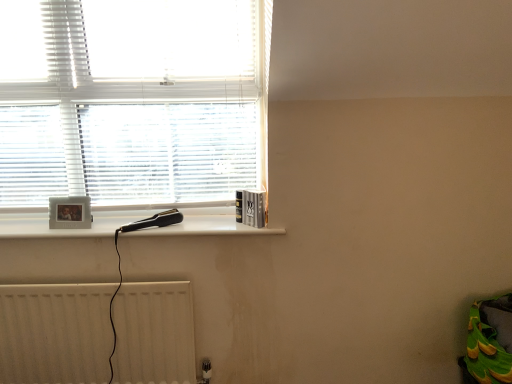
In order to face white textured blinds at upper left, should I rotate leftwards or rightwards?

To face it directly, rotate left by 17.562 degrees.

The image size is (512, 384). Find the location of `white textured radiator at lower left`. white textured radiator at lower left is located at coordinates (55, 333).

Is white textured blinds at upper left at the left side of white textured radiator at lower left?

Incorrect, white textured blinds at upper left is not on the left side of white textured radiator at lower left.

From a real-world perspective, which is physically below, white textured blinds at upper left or white textured radiator at lower left?

white textured radiator at lower left is physically lower.

Is point (230, 173) in front of point (92, 347)?

No.

Is white textured blinds at upper left wider than white textured radiator at lower left?

Indeed, white textured blinds at upper left has a greater width compared to white textured radiator at lower left.

Is white textured radiator at lower left bigger or smaller than white textured blinds at upper left?

Considering their sizes, white textured radiator at lower left takes up less space than white textured blinds at upper left.

Which is correct: white textured radiator at lower left is inside white textured blinds at upper left, or outside of it?

white textured radiator at lower left is not enclosed by white textured blinds at upper left.

From the image's perspective, which object appears higher, white textured radiator at lower left or white textured blinds at upper left?

white textured blinds at upper left.

Is white textured radiator at lower left facing away from white textured blinds at upper left?

No, white textured radiator at lower left's orientation is not away from white textured blinds at upper left.

Is white plastic hairdryer at upper left completely or partially outside of white textured radiator at lower left?

white plastic hairdryer at upper left is positioned outside white textured radiator at lower left.

Considering the positions of points (58, 233) and (25, 330), is point (58, 233) closer to camera compared to point (25, 330)?

Yes, point (58, 233) is in front of point (25, 330).

At what (x,y) coordinates should I click in order to perform the action: click on radiator below the white plastic hairdryer at upper left (from the image's perspective). Please return your answer as a coordinate pair (x, y). Image resolution: width=512 pixels, height=384 pixels. Looking at the image, I should click on (55, 333).

From their relative heights in the image, would you say white plastic hairdryer at upper left is taller or shorter than white textured radiator at lower left?

Considering their sizes, white plastic hairdryer at upper left has less height than white textured radiator at lower left.

Is white textured radiator at lower left inside the boundaries of white plastic hairdryer at upper left, or outside?

white textured radiator at lower left is not inside white plastic hairdryer at upper left, it's outside.

How much distance is there between white textured radiator at lower left and white plastic hairdryer at upper left?

15.89 inches.

Considering the relative sizes of white textured radiator at lower left and white plastic hairdryer at upper left in the image provided, is white textured radiator at lower left shorter than white plastic hairdryer at upper left?

No, white textured radiator at lower left is not shorter than white plastic hairdryer at upper left.

From a real-world perspective, is white textured radiator at lower left positioned under white plastic hairdryer at upper left based on gravity?

Indeed, from a real-world perspective, white textured radiator at lower left is positioned beneath white plastic hairdryer at upper left.

Considering the sizes of objects white textured blinds at upper left and white plastic hairdryer at upper left in the image provided, who is thinner, white textured blinds at upper left or white plastic hairdryer at upper left?

white textured blinds at upper left is thinner.

Which is more to the left, white textured blinds at upper left or white plastic hairdryer at upper left?

Positioned to the left is white textured blinds at upper left.

Is point (238, 60) closer to viewer compared to point (248, 231)?

No.

From the image's perspective, which object appears higher, white textured blinds at upper left or white plastic hairdryer at upper left?

white textured blinds at upper left, from the image's perspective.

From the image's perspective, which one is positioned higher, white plastic hairdryer at upper left or white textured blinds at upper left?

white textured blinds at upper left, from the image's perspective.

Is white plastic hairdryer at upper left facing away from white textured blinds at upper left?

No, white plastic hairdryer at upper left is not facing away from white textured blinds at upper left.

Are white plastic hairdryer at upper left and white textured blinds at upper left beside each other?

white plastic hairdryer at upper left and white textured blinds at upper left are clearly separated.

Locate an element on the screen. The width and height of the screenshot is (512, 384). window above the white plastic hairdryer at upper left (from the image's perspective) is located at coordinates (133, 100).

Locate an element on the screen. window lying on the right of white textured radiator at lower left is located at coordinates (133, 100).

Where is `radiator below the white textured blinds at upper left (from the image's perspective)`? radiator below the white textured blinds at upper left (from the image's perspective) is located at coordinates (55, 333).

When comparing their distances from white plastic hairdryer at upper left, does white textured blinds at upper left or white textured radiator at lower left seem closer?

Based on the image, white textured radiator at lower left appears to be nearer to white plastic hairdryer at upper left.

Looking at this image, looking at the image, which one is located closer to white plastic hairdryer at upper left, white textured radiator at lower left or white textured blinds at upper left?

white textured radiator at lower left is closer to white plastic hairdryer at upper left.

Which object lies further to the anchor point white textured radiator at lower left, white textured blinds at upper left or white plastic hairdryer at upper left?

Based on the image, white textured blinds at upper left appears to be further to white textured radiator at lower left.

Looking at the image, which one is located further to white textured radiator at lower left, white plastic hairdryer at upper left or white textured blinds at upper left?

white textured blinds at upper left is positioned further to the anchor white textured radiator at lower left.

Looking at this image, considering their positions, is white textured radiator at lower left positioned closer to white textured blinds at upper left than white plastic hairdryer at upper left?

The object closer to white textured blinds at upper left is white plastic hairdryer at upper left.

Which object lies further to the anchor point white textured blinds at upper left, white plastic hairdryer at upper left or white textured radiator at lower left?

Based on the image, white textured radiator at lower left appears to be further to white textured blinds at upper left.

Where is `ledge that lies between white textured blinds at upper left and white textured radiator at lower left from top to bottom`? ledge that lies between white textured blinds at upper left and white textured radiator at lower left from top to bottom is located at coordinates (58, 229).